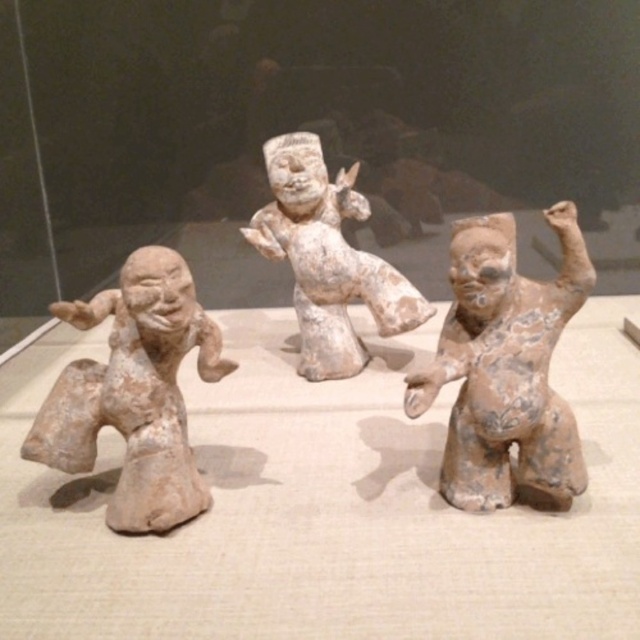
Consider the image. Is the position of earthy clay figure at center less distant than that of white clay figure at center?

Yes, it is.

Who is more forward, (490, 337) or (404, 316)?

Point (490, 337) is more forward.

Where is `earthy clay figure at center`? Image resolution: width=640 pixels, height=640 pixels. earthy clay figure at center is located at coordinates (506, 365).

Based on the photo, is earthy clay figure at center smaller than matte clay figure at left?

No, earthy clay figure at center is not smaller than matte clay figure at left.

Between earthy clay figure at center and matte clay figure at left, which one is positioned higher?

earthy clay figure at center is higher up.

Between point (536, 291) and point (140, 394), which one is positioned behind?

Positioned behind is point (140, 394).

The height and width of the screenshot is (640, 640). Find the location of `earthy clay figure at center`. earthy clay figure at center is located at coordinates (506, 365).

Find the location of a particular element. The height and width of the screenshot is (640, 640). matte clay figure at left is located at coordinates (134, 392).

Is point (129, 282) closer to camera compared to point (262, 148)?

Yes, point (129, 282) is closer to viewer.

Where is `matte clay figure at left`? This screenshot has width=640, height=640. matte clay figure at left is located at coordinates (134, 392).

Find the location of a particular element. matte clay figure at left is located at coordinates (134, 392).